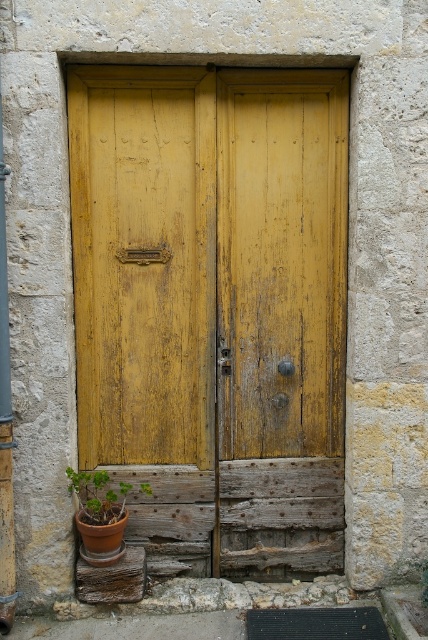
Question: Which object appears farthest from the camera in this image?

Choices:
 (A) green matte pot at lower left
 (B) yellow wood door at center

Answer: (B)

Question: Can you confirm if yellow wood door at center is positioned to the left of green matte pot at lower left?

Choices:
 (A) no
 (B) yes

Answer: (A)

Question: Which of the following is the closest to the observer?

Choices:
 (A) (118, 512)
 (B) (77, 362)

Answer: (A)

Question: Is yellow wood door at center below green matte pot at lower left?

Choices:
 (A) yes
 (B) no

Answer: (B)

Question: Is yellow wood door at center further to the viewer compared to green matte pot at lower left?

Choices:
 (A) no
 (B) yes

Answer: (B)